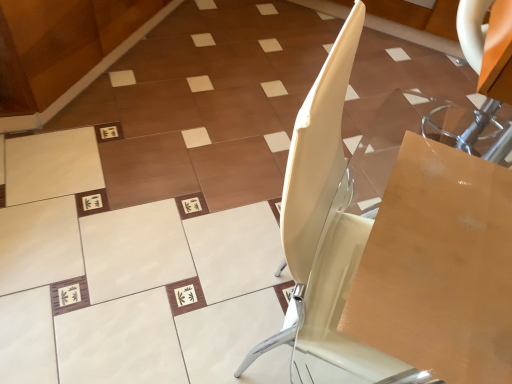
Question: Is white glossy chair at center next to transparent acrylic table at upper right?

Choices:
 (A) no
 (B) yes

Answer: (A)

Question: Is white glossy chair at center facing towards transparent acrylic table at upper right?

Choices:
 (A) no
 (B) yes

Answer: (A)

Question: From the image's perspective, does white glossy chair at center appear lower than transparent acrylic table at upper right?

Choices:
 (A) no
 (B) yes

Answer: (B)

Question: Considering the relative positions of white glossy chair at center and transparent acrylic table at upper right in the image provided, is white glossy chair at center to the left of transparent acrylic table at upper right from the viewer's perspective?

Choices:
 (A) yes
 (B) no

Answer: (A)

Question: From a real-world perspective, is white glossy chair at center below transparent acrylic table at upper right?

Choices:
 (A) no
 (B) yes

Answer: (A)

Question: Considering the positions of transparent acrylic table at upper right and white glossy chair at center in the image, is transparent acrylic table at upper right wider or thinner than white glossy chair at center?

Choices:
 (A) wide
 (B) thin

Answer: (B)

Question: Is point (362, 140) positioned closer to the camera than point (439, 223)?

Choices:
 (A) closer
 (B) farther

Answer: (B)

Question: In terms of size, does transparent acrylic table at upper right appear bigger or smaller than white glossy chair at center?

Choices:
 (A) big
 (B) small

Answer: (B)

Question: In the image, is transparent acrylic table at upper right positioned in front of or behind white glossy chair at center?

Choices:
 (A) behind
 (B) front

Answer: (A)

Question: Considering their positions, is white glossy chair at center located in front of or behind transparent acrylic table at upper right?

Choices:
 (A) behind
 (B) front

Answer: (B)

Question: From a real-world perspective, is white glossy chair at center above or below transparent acrylic table at upper right?

Choices:
 (A) below
 (B) above

Answer: (B)

Question: Considering the positions of white glossy chair at center and transparent acrylic table at upper right in the image, is white glossy chair at center bigger or smaller than transparent acrylic table at upper right?

Choices:
 (A) big
 (B) small

Answer: (A)

Question: Is white glossy chair at center situated inside transparent acrylic table at upper right or outside?

Choices:
 (A) inside
 (B) outside

Answer: (B)

Question: Is point (458, 236) positioned closer to the camera than point (460, 261)?

Choices:
 (A) closer
 (B) farther

Answer: (B)

Question: Is white glossy chair at center inside or outside of wooden cardboard box at center-right?

Choices:
 (A) inside
 (B) outside

Answer: (B)